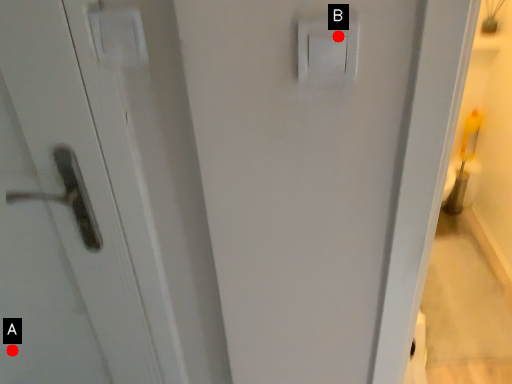
Question: Two points are circled on the image, labeled by A and B beside each circle. Which point is closer to the camera taking this photo?

Choices:
 (A) A is closer
 (B) B is closer

Answer: (B)